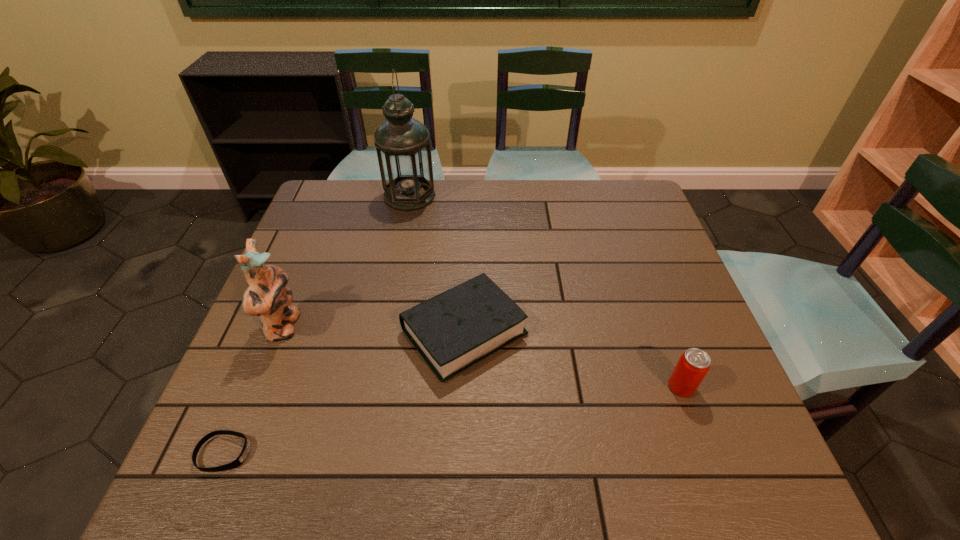
Where is `free point at the left edge`? Image resolution: width=960 pixels, height=540 pixels. free point at the left edge is located at coordinates (288, 365).

Identify the location of vacant space at the right edge. (660, 237).

The width and height of the screenshot is (960, 540). In the image, there is a desktop. Find the location of `vacant space at the far left corner`. vacant space at the far left corner is located at coordinates (323, 194).

Image resolution: width=960 pixels, height=540 pixels. Find the location of `vacant space at the far right corner`. vacant space at the far right corner is located at coordinates (624, 204).

Identify the location of vacant space that is in between the shortest object and the figurine. Image resolution: width=960 pixels, height=540 pixels. (254, 390).

Locate an element on the screen. This screenshot has width=960, height=540. empty space between the fourth shortest object and the shortest object is located at coordinates (254, 390).

Identify the location of empty space that is in between the Bible and the second tallest object. This screenshot has height=540, width=960. (374, 329).

The image size is (960, 540). I want to click on free space between the fourth shortest object and the wristband, so click(x=254, y=390).

Locate an element on the screen. The image size is (960, 540). vacant area that lies between the shortest object and the Bible is located at coordinates (345, 392).

This screenshot has height=540, width=960. In order to click on free spot between the figurine and the farthest object in this screenshot , I will do coord(347,261).